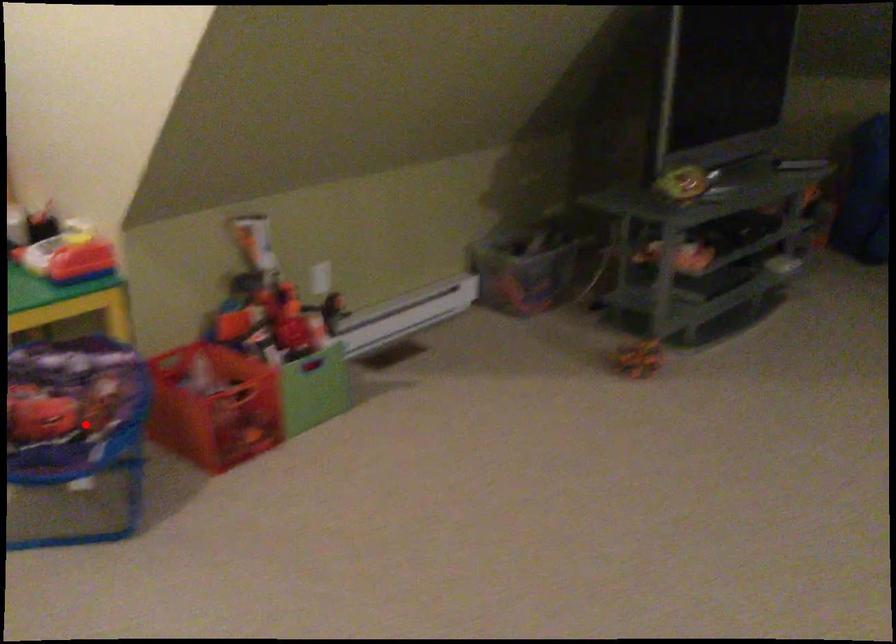
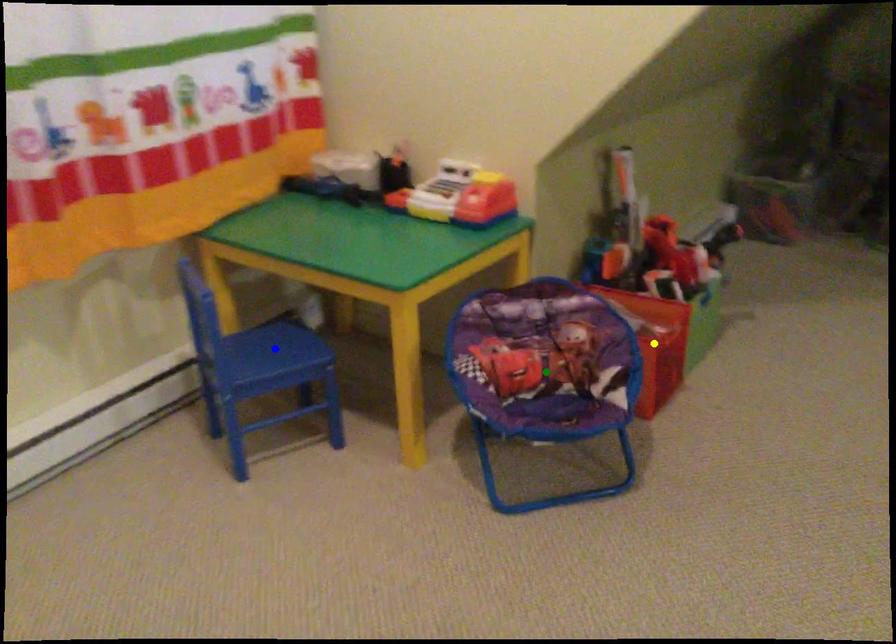
Question: I am providing you with two images of the same scene from different viewpoints. A red point is marked on the first image. You are given multiple points on the second image. Can you choose the point in image 2 that corresponds to the point in image 1?

Choices:
 (A) yellow point
 (B) green point
 (C) blue point

Answer: (B)